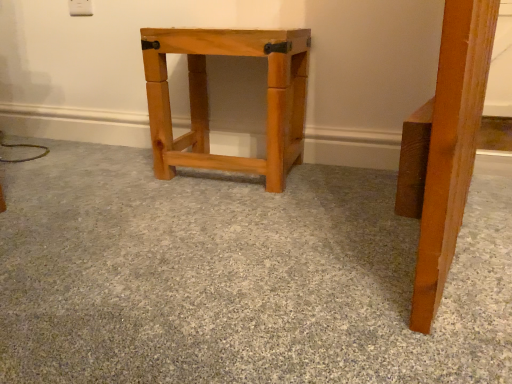
Question: Is natural wood stool at center further to the viewer compared to natural wood table at center?

Choices:
 (A) yes
 (B) no

Answer: (A)

Question: From a real-world perspective, is natural wood stool at center over natural wood table at center?

Choices:
 (A) no
 (B) yes

Answer: (B)

Question: Is natural wood stool at center surrounding natural wood table at center?

Choices:
 (A) no
 (B) yes

Answer: (A)

Question: From the image's perspective, is natural wood stool at center above natural wood table at center?

Choices:
 (A) yes
 (B) no

Answer: (A)

Question: Considering the relative sizes of natural wood stool at center and natural wood table at center in the image provided, is natural wood stool at center wider than natural wood table at center?

Choices:
 (A) no
 (B) yes

Answer: (A)

Question: Can you confirm if natural wood stool at center is shorter than natural wood table at center?

Choices:
 (A) no
 (B) yes

Answer: (A)

Question: Is natural wood table at center at the right side of natural wood stool at center?

Choices:
 (A) yes
 (B) no

Answer: (B)

Question: From a real-world perspective, is natural wood table at center physically above natural wood stool at center?

Choices:
 (A) no
 (B) yes

Answer: (A)

Question: From the image's perspective, would you say natural wood table at center is positioned over natural wood stool at center?

Choices:
 (A) no
 (B) yes

Answer: (A)

Question: Is natural wood table at center thinner than natural wood stool at center?

Choices:
 (A) yes
 (B) no

Answer: (B)

Question: Is natural wood table at center facing away from natural wood stool at center?

Choices:
 (A) yes
 (B) no

Answer: (B)

Question: Is natural wood table at center taller than natural wood stool at center?

Choices:
 (A) no
 (B) yes

Answer: (A)

Question: Considering the positions of natural wood stool at center and natural wood table at center in the image, is natural wood stool at center taller or shorter than natural wood table at center?

Choices:
 (A) short
 (B) tall

Answer: (B)